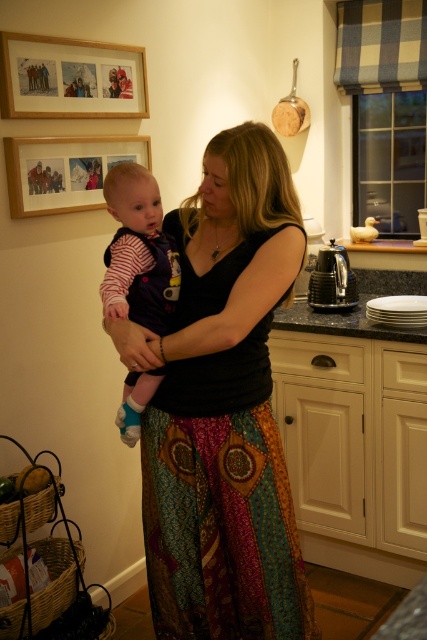
Find the location of a particular element. The width and height of the screenshot is (427, 640). black matte tank top at center is located at coordinates (222, 406).

Locate an element on the screen. black matte tank top at center is located at coordinates (222, 406).

Who is higher up, black matte tank top at center or wooden picture frame at upper left?

Positioned higher is wooden picture frame at upper left.

Between black matte tank top at center and wooden picture frame at upper left, which one appears on the left side from the viewer's perspective?

wooden picture frame at upper left

Is point (192, 403) farther from viewer compared to point (108, 76)?

No, it is in front of (108, 76).

Where is `black matte tank top at center`? The image size is (427, 640). black matte tank top at center is located at coordinates (222, 406).

Between black matte tank top at center and wooden framed picture at upper left, which one appears on the left side from the viewer's perspective?

From the viewer's perspective, wooden framed picture at upper left appears more on the left side.

The height and width of the screenshot is (640, 427). Identify the location of black matte tank top at center. (222, 406).

Does point (157, 362) come farther from viewer compared to point (44, 148)?

No, it is in front of (44, 148).

The height and width of the screenshot is (640, 427). I want to click on black matte tank top at center, so click(x=222, y=406).